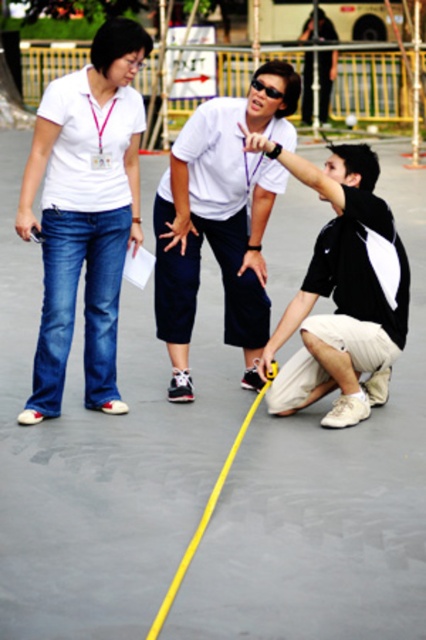
Find the location of `matte white shirt at upper left`. matte white shirt at upper left is located at coordinates (85, 212).

Looking at this image, between matte white shirt at upper left and black matte tape measure at lower right, which one appears on the left side from the viewer's perspective?

matte white shirt at upper left

Between point (83, 154) and point (359, 314), which one is positioned behind?

Point (359, 314)

Where is `matte white shirt at upper left`? This screenshot has height=640, width=426. matte white shirt at upper left is located at coordinates (85, 212).

Image resolution: width=426 pixels, height=640 pixels. What do you see at coordinates (221, 220) in the screenshot? I see `white matte shirt at center` at bounding box center [221, 220].

Which is in front, point (164, 321) or point (368, 179)?

Positioned in front is point (368, 179).

Who is more distant from viewer, (x=238, y=216) or (x=351, y=381)?

Positioned behind is point (x=238, y=216).

Find the location of `white matte shirt at center`. white matte shirt at center is located at coordinates (221, 220).

Where is `matte white shirt at upper left`? Image resolution: width=426 pixels, height=640 pixels. matte white shirt at upper left is located at coordinates (85, 212).

Is matte white shirt at upper left bigger than white matte shirt at center?

Incorrect, matte white shirt at upper left is not larger than white matte shirt at center.

Who is more distant from viewer, (34, 154) or (261, 211)?

Positioned behind is point (261, 211).

Locate an element on the screen. matte white shirt at upper left is located at coordinates (85, 212).